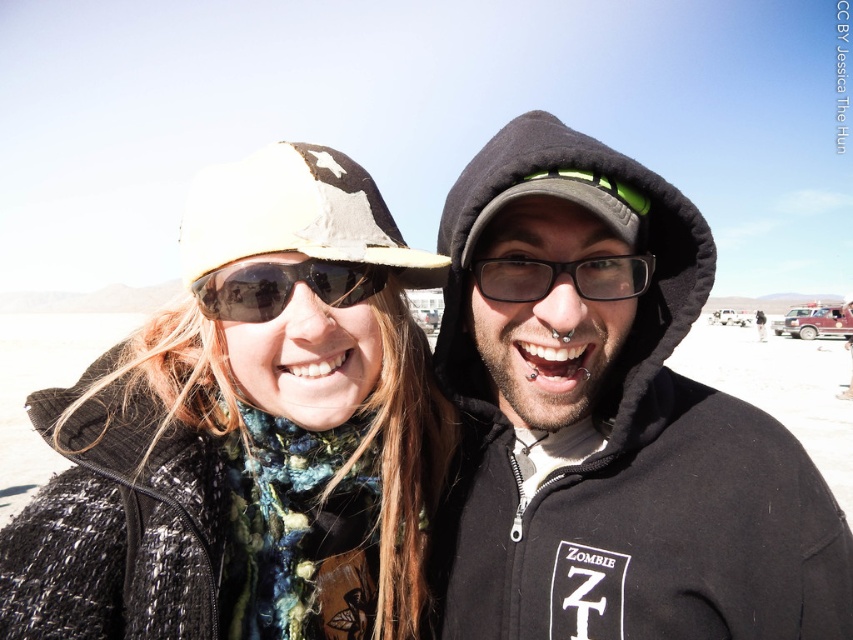
Between knitted scarf at center and black plastic glasses at center, which one appears on the right side from the viewer's perspective?

black plastic glasses at center is more to the right.

Can you confirm if knitted scarf at center is wider than black plastic glasses at center?

Indeed, knitted scarf at center has a greater width compared to black plastic glasses at center.

Between point (415, 518) and point (618, 285), which one is positioned behind?

The point (415, 518) is more distant.

This screenshot has width=853, height=640. Find the location of `knitted scarf at center`. knitted scarf at center is located at coordinates (247, 428).

Which is behind, point (741, 547) or point (206, 307)?

Point (741, 547)

Is black hoodie at center above sunglasses at center?

No, black hoodie at center is not above sunglasses at center.

Does point (462, 536) come in front of point (288, 289)?

No.

Where is `black hoodie at center`? black hoodie at center is located at coordinates (611, 428).

Where is `black hoodie at center`? black hoodie at center is located at coordinates (611, 428).

Does black hoodie at center have a larger size compared to knitted scarf at center?

Correct, black hoodie at center is larger in size than knitted scarf at center.

Between point (757, 630) and point (151, 608), which one is positioned in front?

Point (151, 608) is in front.

Locate an element on the screen. The height and width of the screenshot is (640, 853). black hoodie at center is located at coordinates (611, 428).